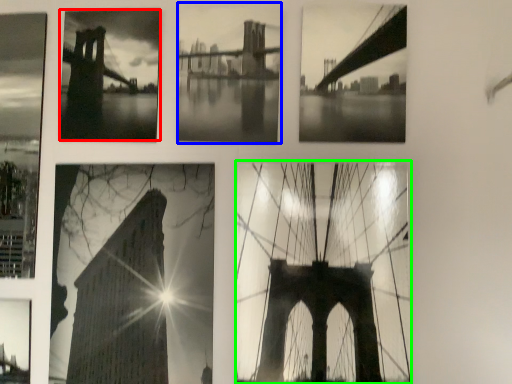
Question: Considering the real-world distances, which object is closest to picture frame (highlighted by a red box)? picture frame (highlighted by a blue box) or picture frame (highlighted by a green box).

Choices:
 (A) picture frame
 (B) picture frame

Answer: (A)